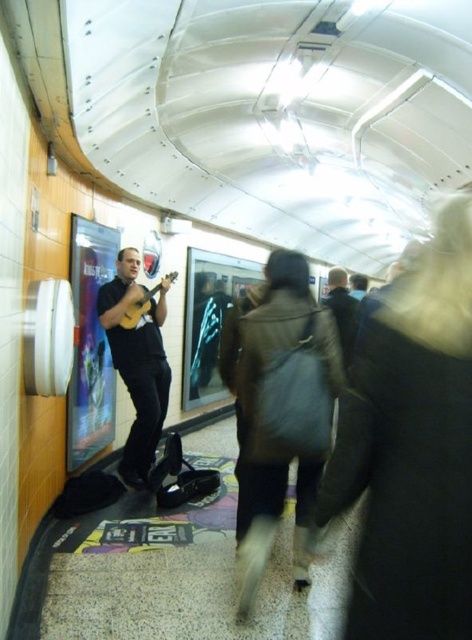
Identify the location of matte black ukulele at left. This screenshot has height=640, width=472. (137, 360).

Measure the distance from matte black ukulele at left to yellow matte guitar at left.

matte black ukulele at left is 12.98 inches away from yellow matte guitar at left.

Is point (142, 416) farther from camera compared to point (143, 300)?

That is True.

You are a GUI agent. You are given a task and a screenshot of the screen. Output one action in this format:
    pyautogui.click(x=<x>, y=<y>)
    Task: Click on the matte black ukulele at left
    
    Given the screenshot: What is the action you would take?
    pyautogui.click(x=137, y=360)

Does dark brown leather jacket at center appear on the right side of yellow matte guitar at left?

Indeed, dark brown leather jacket at center is positioned on the right side of yellow matte guitar at left.

Is dark brown leather jacket at center smaller than yellow matte guitar at left?

Actually, dark brown leather jacket at center might be larger than yellow matte guitar at left.

Measure the distance between point [351,316] and camera.

They are 13.15 feet apart.

Find the location of a particular element. dark brown leather jacket at center is located at coordinates (342, 308).

Measure the distance between matte black ukulele at left and camera.

They are 3.59 meters apart.

Is matte black ukulele at left positioned in front of dark brown leather jacket at center?

No, matte black ukulele at left is behind dark brown leather jacket at center.

At what (x,y) coordinates should I click in order to perform the action: click on matte black ukulele at left. Please return your answer as a coordinate pair (x, y). This screenshot has width=472, height=640. Looking at the image, I should click on (137, 360).